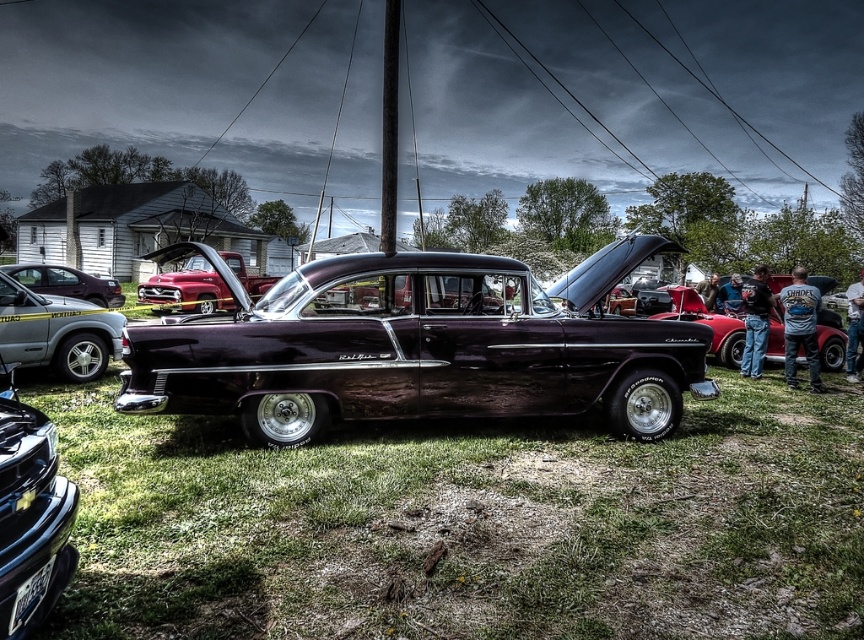
Question: Where is shiny dark purple car at center located in relation to metallic silver suv at left in the image?

Choices:
 (A) left
 (B) right

Answer: (B)

Question: Which is farther from the shiny metallic car at left?

Choices:
 (A) green grass at center
 (B) shiny red car at center
 (C) metallic silver suv at left

Answer: (A)

Question: In this image, where is green grass at center located relative to metallic silver suv at left?

Choices:
 (A) right
 (B) left

Answer: (A)

Question: Can you confirm if shiny dark purple car at center is bigger than metallic silver suv at left?

Choices:
 (A) yes
 (B) no

Answer: (A)

Question: Which point is closer to the camera?

Choices:
 (A) 67,316
 (B) 677,560
 (C) 181,308
 (D) 576,392

Answer: (B)

Question: Which object is the farthest from the metallic silver suv at left?

Choices:
 (A) shiny metallic car at left
 (B) shiny red car at center
 (C) green grass at center

Answer: (A)